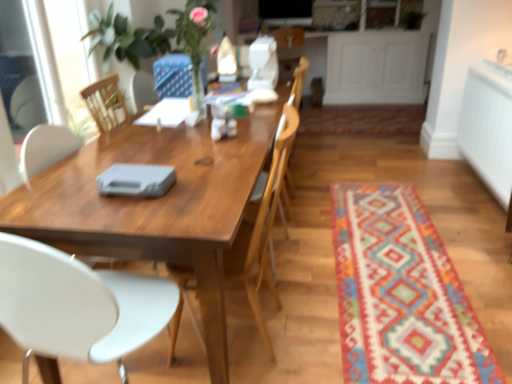
Identify the location of free spot to the left of white textured radiator at right. (360, 181).